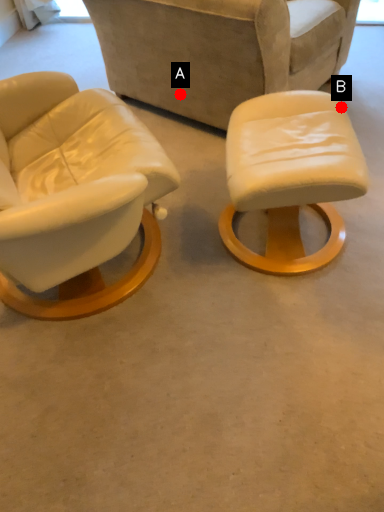
Question: Two points are circled on the image, labeled by A and B beside each circle. Which point is closer to the camera taking this photo?

Choices:
 (A) A is closer
 (B) B is closer

Answer: (A)